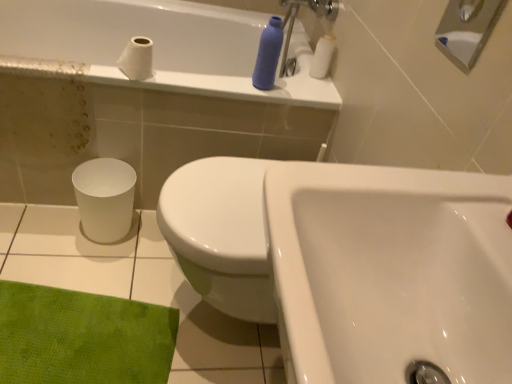
Find the location of a particular element. Image resolution: width=512 pixels, height=384 pixels. free spot to the left of white matte toilet paper at upper left, the first toilet paper when ordered from front to back is located at coordinates (81, 72).